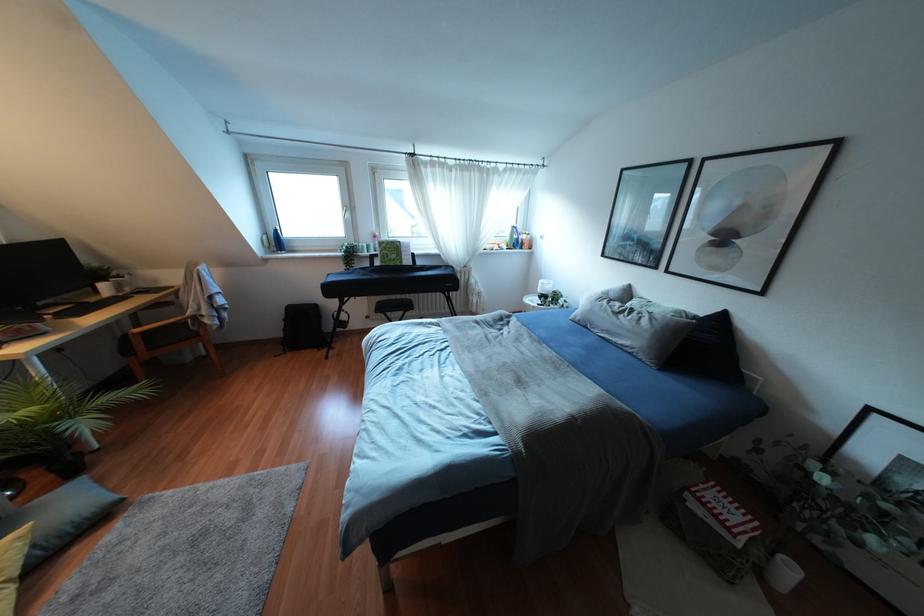
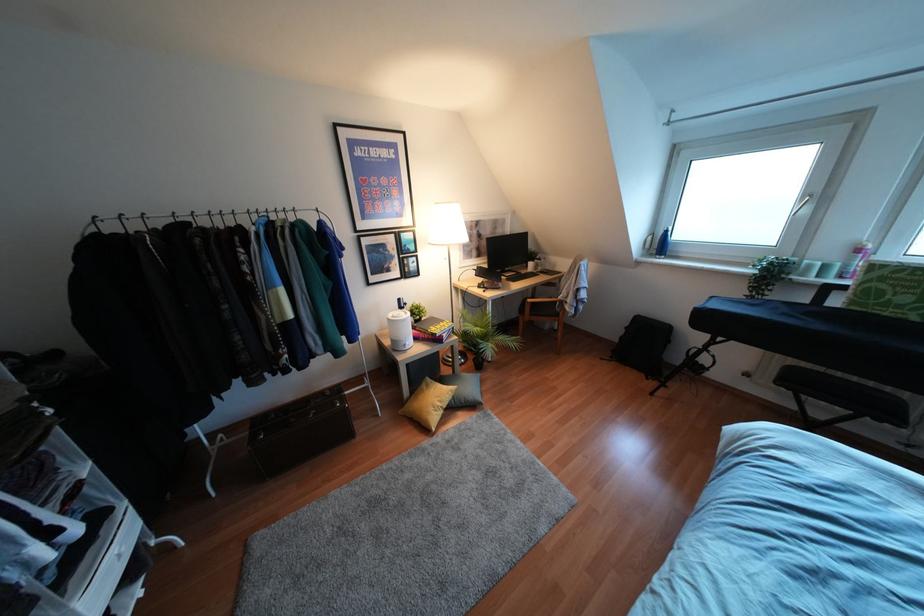
Where in the second image is the point corresponding to [32,546] from the first image?

(453, 397)